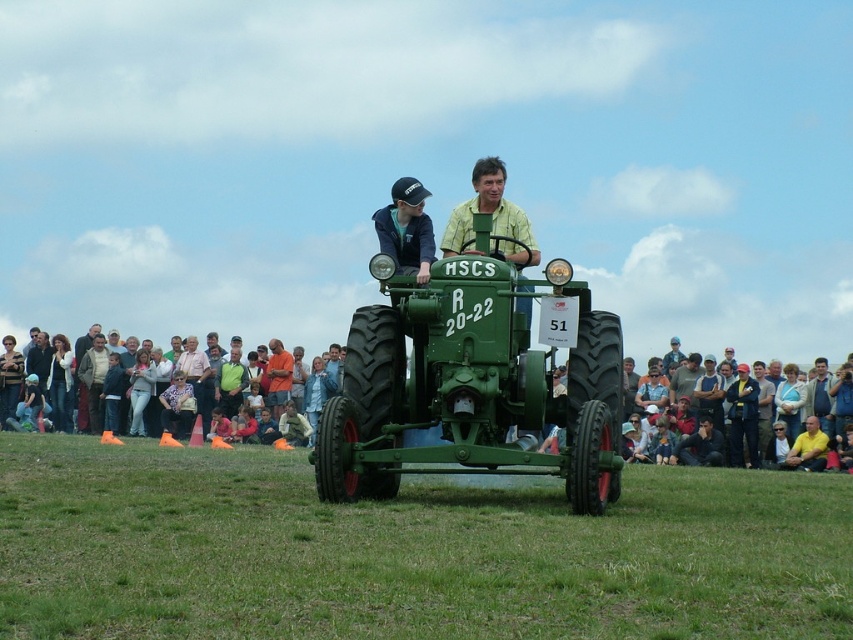
Question: Can you confirm if denim jacket at lower left is positioned above matte black cap at center?

Choices:
 (A) yes
 (B) no

Answer: (B)

Question: Which of the following is the farthest from the observer?

Choices:
 (A) (276, 360)
 (B) (424, 410)

Answer: (A)

Question: Can you confirm if denim jacket at lower left is thinner than orange t-shirt at center?

Choices:
 (A) no
 (B) yes

Answer: (A)

Question: Estimate the real-world distances between objects in this image. Which object is farther from the orange t-shirt at center?

Choices:
 (A) light brown fabric crowd at lower right
 (B) green matte tractor at center

Answer: (B)

Question: Which of the following is the closest to the observer?

Choices:
 (A) (402, 212)
 (B) (149, 561)
 (C) (395, 356)
 (D) (755, 392)

Answer: (B)

Question: Is green matte tractor at center to the left of dark blue jacket at center from the viewer's perspective?

Choices:
 (A) no
 (B) yes

Answer: (B)